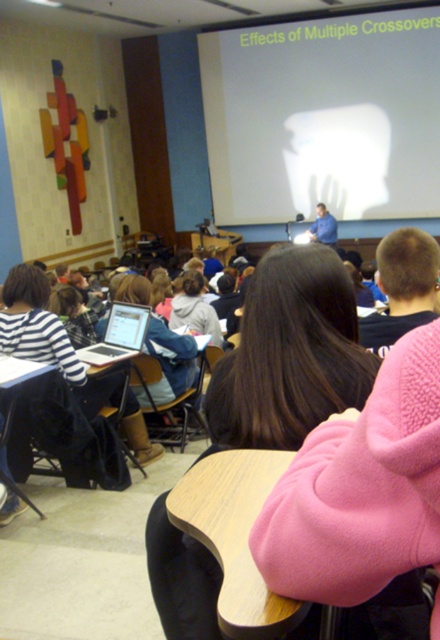
Question: Observing the image, what is the correct spatial positioning of white matte projection screen at upper center in reference to silver metallic laptop at center?

Choices:
 (A) above
 (B) below

Answer: (A)

Question: Is white matte projection screen at upper center wider than brown hair at center?

Choices:
 (A) no
 (B) yes

Answer: (B)

Question: Is white matte projection screen at upper center below silver metallic laptop at center?

Choices:
 (A) yes
 (B) no

Answer: (B)

Question: Which point is closer to the camera?

Choices:
 (A) silver metallic laptop at center
 (B) white matte projection screen at upper center
 (C) brown hair at center

Answer: (C)

Question: Which object is positioned farthest from the silver metallic laptop at center?

Choices:
 (A) white matte projection screen at upper center
 (B) brown hair at center

Answer: (A)

Question: Which point appears farthest from the camera in this image?

Choices:
 (A) (297, 426)
 (B) (407, 161)

Answer: (B)